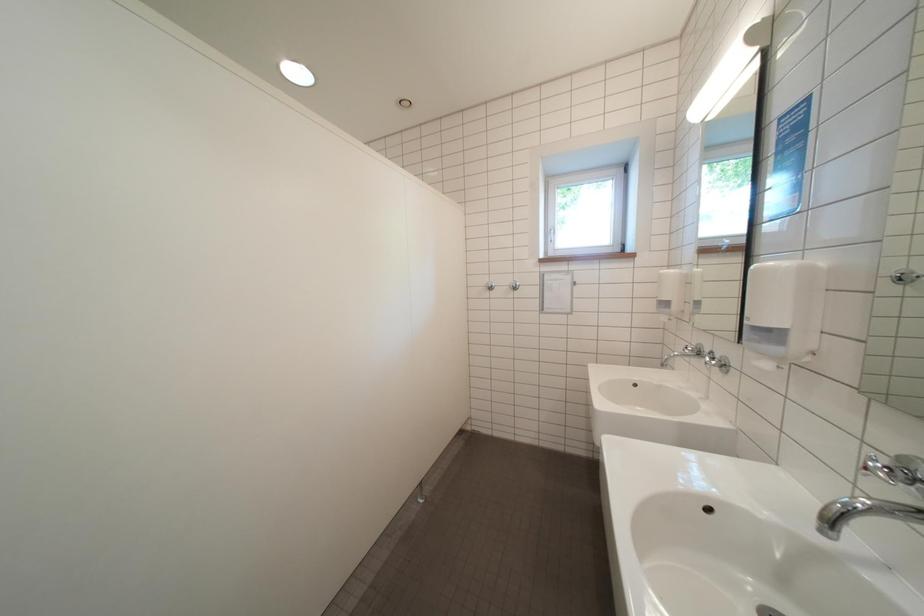
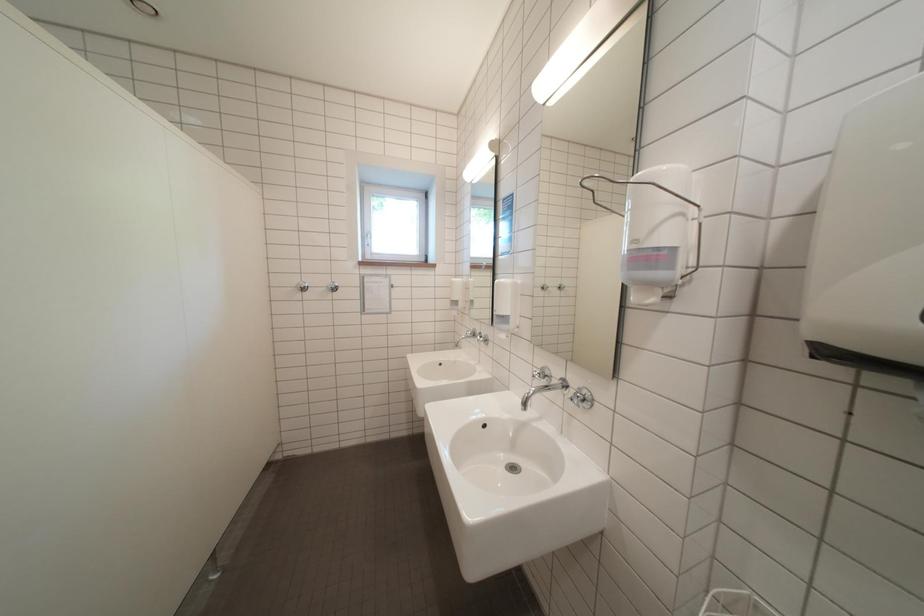
Question: The images are taken continuously from a first-person perspective. In which direction is your viewpoint rotating?

Choices:
 (A) Left
 (B) Right
 (C) Up
 (D) Down

Answer: (B)